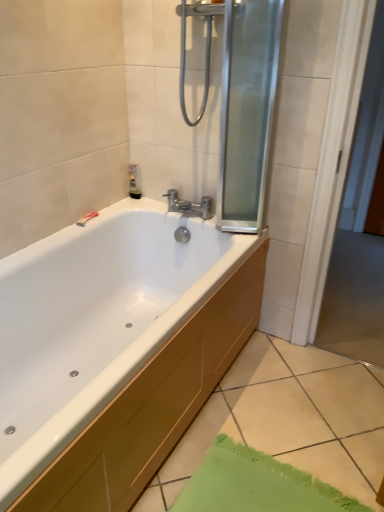
What is the approximate width of white glossy bathtub at lower left?

white glossy bathtub at lower left is 1.12 meters in width.

You are a GUI agent. You are given a task and a screenshot of the screen. Output one action in this format:
    pyautogui.click(x=<x>, y=<y>)
    Task: Click on the chrome metallic faucet at center
    
    Given the screenshot: What is the action you would take?
    pyautogui.click(x=189, y=205)

Between translucent plastic tube at upper left and transparent glass screen door at upper right, which one has larger width?

With larger width is transparent glass screen door at upper right.

Which of these two, translucent plastic tube at upper left or transparent glass screen door at upper right, stands shorter?

translucent plastic tube at upper left.

You are a GUI agent. You are given a task and a screenshot of the screen. Output one action in this format:
    pyautogui.click(x=<x>, y=<y>)
    Task: Click on the screen door above the translucent plastic tube at upper left (from a real-world perspective)
    
    Given the screenshot: What is the action you would take?
    pyautogui.click(x=247, y=110)

Considering the sizes of objects white glossy bathtub at lower left and transparent glass screen door at upper right in the image provided, who is wider, white glossy bathtub at lower left or transparent glass screen door at upper right?

With larger width is white glossy bathtub at lower left.

Is white glossy bathtub at lower left looking in the opposite direction of transparent glass screen door at upper right?

white glossy bathtub at lower left is not turned away from transparent glass screen door at upper right.

From the image's perspective, is white glossy bathtub at lower left positioned above or below transparent glass screen door at upper right?

white glossy bathtub at lower left is situated lower than transparent glass screen door at upper right in the image.

Considering the positions of point (101, 398) and point (222, 123), is point (101, 398) closer or farther from the camera than point (222, 123)?

Point (101, 398) is positioned closer to the camera compared to point (222, 123).

In the scene shown: Considering the relative positions of chrome metallic faucet at center and white glossy bathtub at lower left in the image provided, is chrome metallic faucet at center to the left of white glossy bathtub at lower left from the viewer's perspective?

Correct, you'll find chrome metallic faucet at center to the left of white glossy bathtub at lower left.

Does chrome metallic faucet at center have a greater height compared to white glossy bathtub at lower left?

Correct, chrome metallic faucet at center is much taller as white glossy bathtub at lower left.

Between chrome metallic faucet at center and white glossy bathtub at lower left, which one has larger width?

white glossy bathtub at lower left is wider.

Is chrome metallic faucet at center next to white glossy bathtub at lower left and touching it?

No, chrome metallic faucet at center is not making contact with white glossy bathtub at lower left.

From a real-world perspective, is chrome metallic faucet at center over transparent glass screen door at upper right?

Actually, chrome metallic faucet at center is physically below transparent glass screen door at upper right in the real world.

Is chrome metallic faucet at center spatially inside transparent glass screen door at upper right, or outside of it?

chrome metallic faucet at center is outside transparent glass screen door at upper right.

This screenshot has height=512, width=384. I want to click on tap that is below the transparent glass screen door at upper right (from the image's perspective), so click(189, 205).

From the image's perspective, is chrome metallic faucet at center located above or below transparent glass screen door at upper right?

Clearly, from the image's perspective, chrome metallic faucet at center is below transparent glass screen door at upper right.

Is translucent plastic tube at upper left next to white glossy bathtub at lower left?

No, translucent plastic tube at upper left is not making contact with white glossy bathtub at lower left.

From a real-world perspective, is translucent plastic tube at upper left physically located above or below white glossy bathtub at lower left?

From a real-world perspective, translucent plastic tube at upper left is physically above white glossy bathtub at lower left.

Which is farther from the camera, (130, 185) or (261, 268)?

Positioned behind is point (130, 185).

You are a GUI agent. You are given a task and a screenshot of the screen. Output one action in this format:
    pyautogui.click(x=<x>, y=<y>)
    Task: Click on the bathtub on the right of the translucent plastic tube at upper left
    The image size is (384, 512).
    Given the screenshot: What is the action you would take?
    pyautogui.click(x=115, y=350)

From a real-world perspective, which is physically above, white glossy bathtub at lower left or chrome metallic faucet at center?

In real-world perspective, chrome metallic faucet at center is above.

Which is nearer, (x=157, y=375) or (x=207, y=198)?

The point (x=157, y=375) is more forward.

Find the location of `bathtub to the right of chrome metallic faucet at center`. bathtub to the right of chrome metallic faucet at center is located at coordinates (115, 350).

Would you say white glossy bathtub at lower left contains chrome metallic faucet at center?

That's incorrect, chrome metallic faucet at center is not inside white glossy bathtub at lower left.

Does translucent plastic tube at upper left have a larger size compared to chrome metallic faucet at center?

No, translucent plastic tube at upper left is not bigger than chrome metallic faucet at center.

Is translucent plastic tube at upper left positioned beyond the bounds of chrome metallic faucet at center?

Yes, translucent plastic tube at upper left is outside of chrome metallic faucet at center.

In the scene shown: Visually, is translucent plastic tube at upper left positioned to the left or to the right of chrome metallic faucet at center?

In the image, translucent plastic tube at upper left appears on the left side of chrome metallic faucet at center.

At what (x,y) coordinates should I click in order to perform the action: click on screen door above the translucent plastic tube at upper left (from the image's perspective). Please return your answer as a coordinate pair (x, y). This screenshot has width=384, height=512. Looking at the image, I should click on [247, 110].

The height and width of the screenshot is (512, 384). I want to click on screen door located behind the white glossy bathtub at lower left, so click(247, 110).

From the image, which object appears to be farther from transparent glass screen door at upper right, white glossy bathtub at lower left or chrome metallic faucet at center?

white glossy bathtub at lower left is positioned further to the anchor transparent glass screen door at upper right.

Based on the photo, looking at the image, which one is located closer to transparent glass screen door at upper right, chrome metallic faucet at center or white glossy bathtub at lower left?

chrome metallic faucet at center.

Looking at the image, which one is located closer to white glossy bathtub at lower left, translucent plastic tube at upper left or transparent glass screen door at upper right?

transparent glass screen door at upper right is positioned closer to the anchor white glossy bathtub at lower left.

Based on their spatial positions, is chrome metallic faucet at center or white glossy bathtub at lower left further from translucent plastic tube at upper left?

The object further to translucent plastic tube at upper left is white glossy bathtub at lower left.

Looking at the image, which one is located closer to transparent glass screen door at upper right, translucent plastic tube at upper left or white glossy bathtub at lower left?

white glossy bathtub at lower left is positioned closer to the anchor transparent glass screen door at upper right.

Based on the photo, considering their positions, is transparent glass screen door at upper right positioned closer to translucent plastic tube at upper left than chrome metallic faucet at center?

chrome metallic faucet at center is positioned closer to the anchor translucent plastic tube at upper left.

Considering their positions, is chrome metallic faucet at center positioned further to white glossy bathtub at lower left than translucent plastic tube at upper left?

translucent plastic tube at upper left is positioned further to the anchor white glossy bathtub at lower left.

From the image, which object appears to be nearer to white glossy bathtub at lower left, transparent glass screen door at upper right or translucent plastic tube at upper left?

transparent glass screen door at upper right is positioned closer to the anchor white glossy bathtub at lower left.

I want to click on tap between transparent glass screen door at upper right and white glossy bathtub at lower left from top to bottom, so click(x=189, y=205).

Where is `tap positioned between transparent glass screen door at upper right and translucent plastic tube at upper left from near to far`? Image resolution: width=384 pixels, height=512 pixels. tap positioned between transparent glass screen door at upper right and translucent plastic tube at upper left from near to far is located at coordinates (189, 205).

The height and width of the screenshot is (512, 384). In order to click on tap between white glossy bathtub at lower left and translucent plastic tube at upper left from front to back in this screenshot , I will do `click(189, 205)`.

Where is `toiletry between transparent glass screen door at upper right and white glossy bathtub at lower left vertically`? The height and width of the screenshot is (512, 384). toiletry between transparent glass screen door at upper right and white glossy bathtub at lower left vertically is located at coordinates (134, 181).